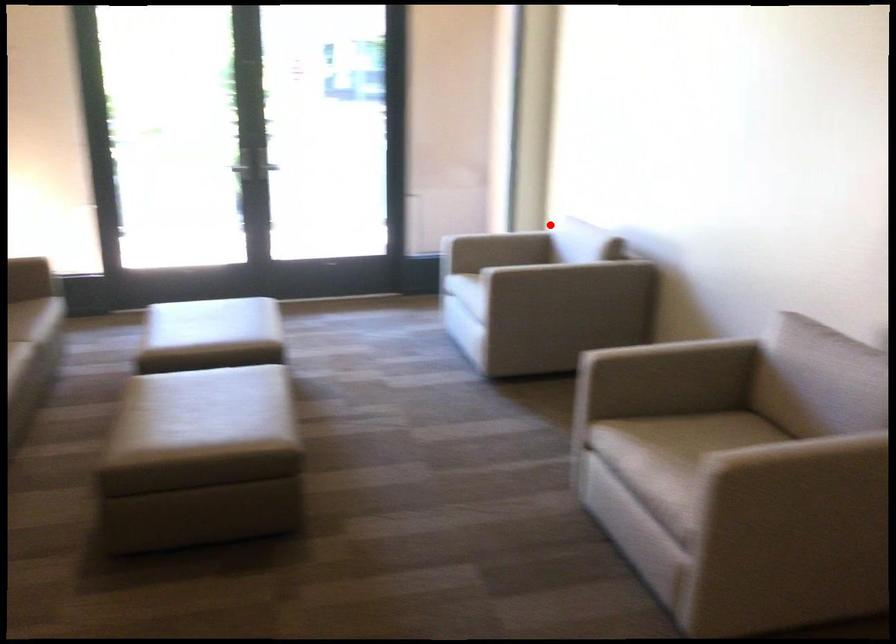
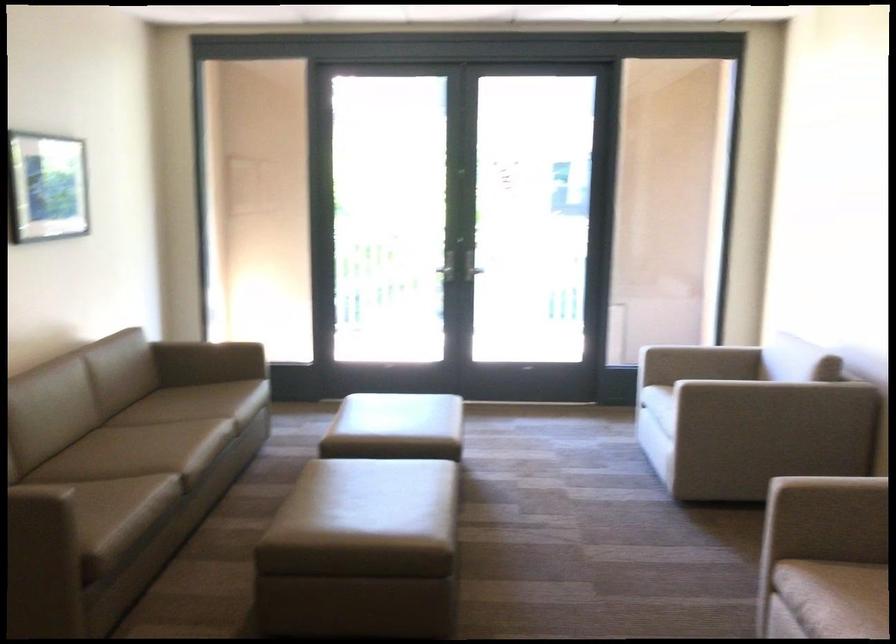
In the second image, find the point that corresponds to the highlighted location in the first image.

(762, 346)